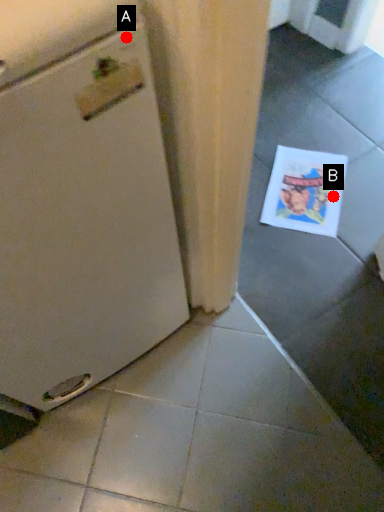
Question: Two points are circled on the image, labeled by A and B beside each circle. Which point is farther to the camera?

Choices:
 (A) A is further
 (B) B is further

Answer: (B)